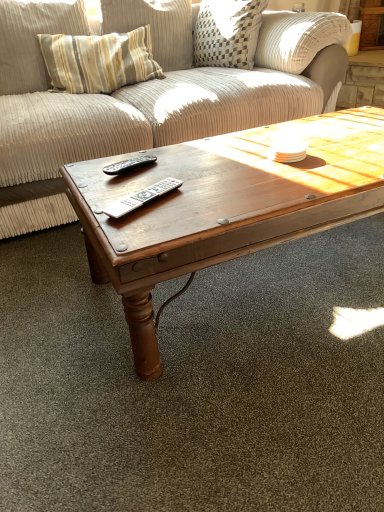
Find the location of `space that is in front of silver metallic remote at center, marked as the second remote in a top-to-bottom arrangement`. space that is in front of silver metallic remote at center, marked as the second remote in a top-to-bottom arrangement is located at coordinates (147, 227).